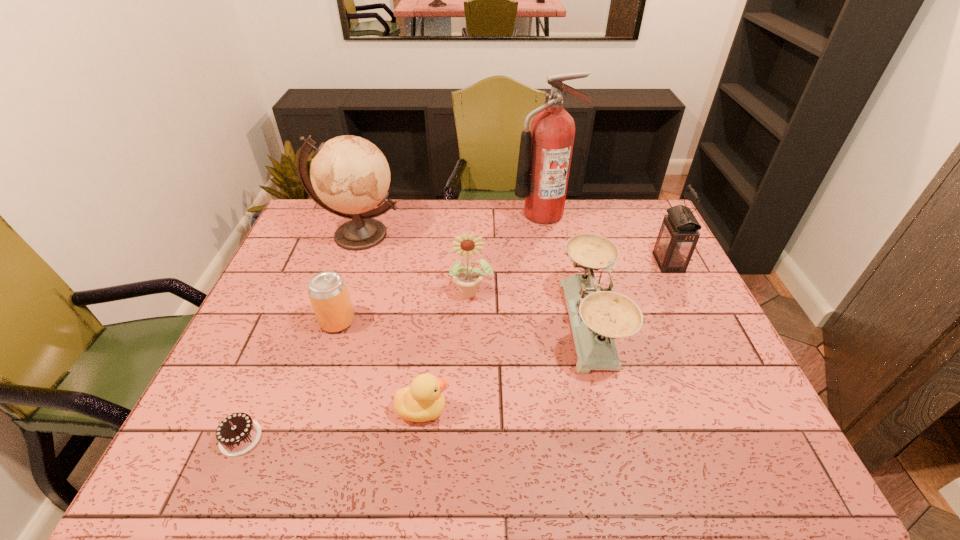
At what (x,y) coordinates should I click in order to perform the action: click on vacant space located on the front-facing side of the lantern. Please return your answer as a coordinate pair (x, y). Looking at the image, I should click on (638, 262).

Where is `vacant space located on the front-facing side of the lantern`? Image resolution: width=960 pixels, height=540 pixels. vacant space located on the front-facing side of the lantern is located at coordinates (597, 262).

Locate an element on the screen. This screenshot has width=960, height=540. free space located on the front-facing side of the lantern is located at coordinates (547, 262).

Locate an element on the screen. vacant space located on the front-facing side of the sunflower is located at coordinates (470, 350).

At what (x,y) coordinates should I click in order to perform the action: click on vacant space situated 0.170m on the front-facing side of the scale. Please return your answer as a coordinate pair (x, y). This screenshot has width=960, height=540. Looking at the image, I should click on (501, 325).

The image size is (960, 540). In order to click on vacant area situated 0.210m on the front-facing side of the scale in this screenshot , I will do `click(487, 325)`.

I want to click on free space located on the front-facing side of the scale, so coord(501,325).

Locate an element on the screen. The width and height of the screenshot is (960, 540). vacant space located on the back of the sixth tallest object is located at coordinates (358, 257).

The height and width of the screenshot is (540, 960). Identify the location of vacant region located 0.110m at the beak of the second shortest object. (497, 409).

At what (x,y) coordinates should I click in order to perform the action: click on free space located 0.350m on the right of the chocolate cake. Please return your answer as a coordinate pair (x, y). The width and height of the screenshot is (960, 540). Looking at the image, I should click on click(421, 437).